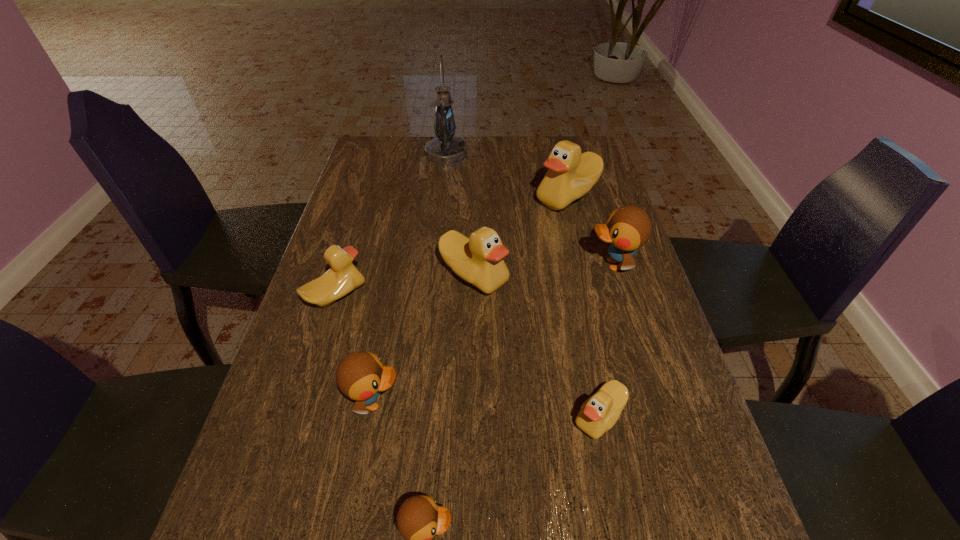
Where is `vacant region located on the front-facing side of the second smallest blue duck`? The width and height of the screenshot is (960, 540). vacant region located on the front-facing side of the second smallest blue duck is located at coordinates (576, 402).

Where is `vacant space positioned at the beak of the leftmost duck`? vacant space positioned at the beak of the leftmost duck is located at coordinates (393, 295).

Find the location of `vacant space situated at the beak of the nearest beige duck`. vacant space situated at the beak of the nearest beige duck is located at coordinates (547, 416).

Locate an element on the screen. This screenshot has width=960, height=540. vacant space located at the beak of the nearest beige duck is located at coordinates (486, 416).

This screenshot has width=960, height=540. Identify the location of vacant region located at the beak of the nearest beige duck. (430, 416).

Identify the location of object located at the far edge. (445, 149).

The height and width of the screenshot is (540, 960). In the image, there is a desktop. What are the coordinates of `vacant area at the far edge` in the screenshot? It's located at (420, 161).

I want to click on free space at the left edge of the desktop, so click(x=357, y=208).

Locate an element on the screen. free space at the right edge of the desktop is located at coordinates (635, 294).

Identify the location of vacant space at the far left corner of the desktop. (360, 164).